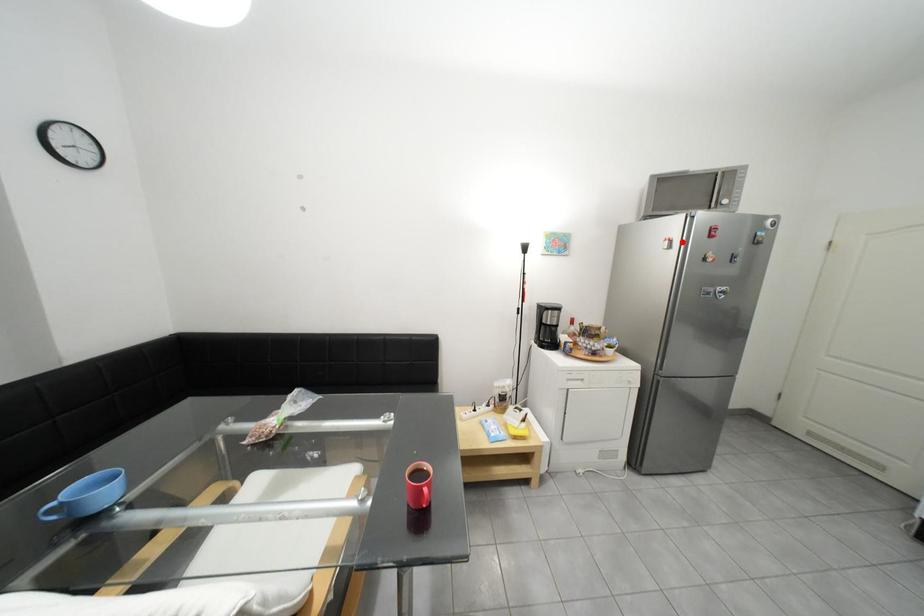
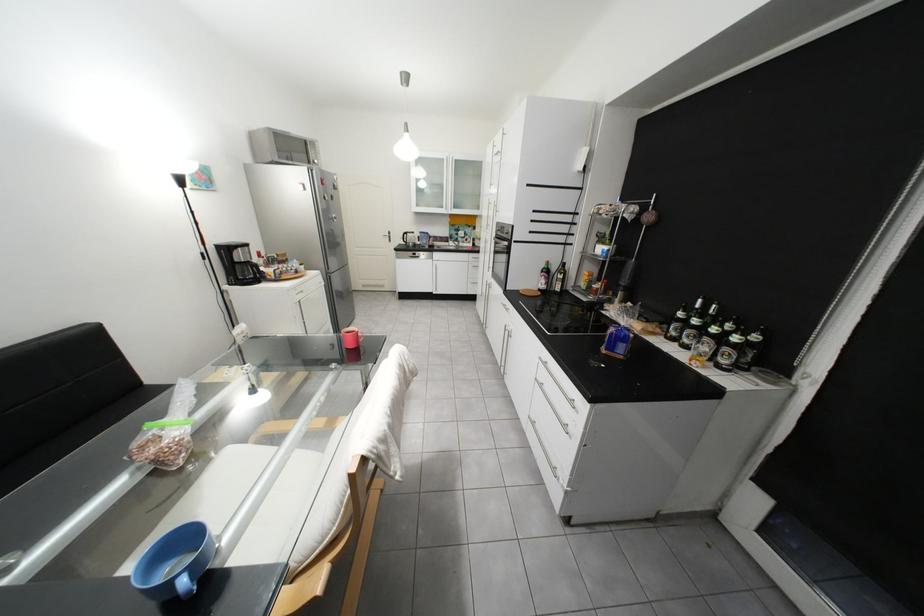
Question: I am providing you with two images of the same scene from different viewpoints. A red point is marked on the first image. At the location where the point appears in image 1, is it still visible in image 2?

Choices:
 (A) Yes
 (B) No

Answer: (A)